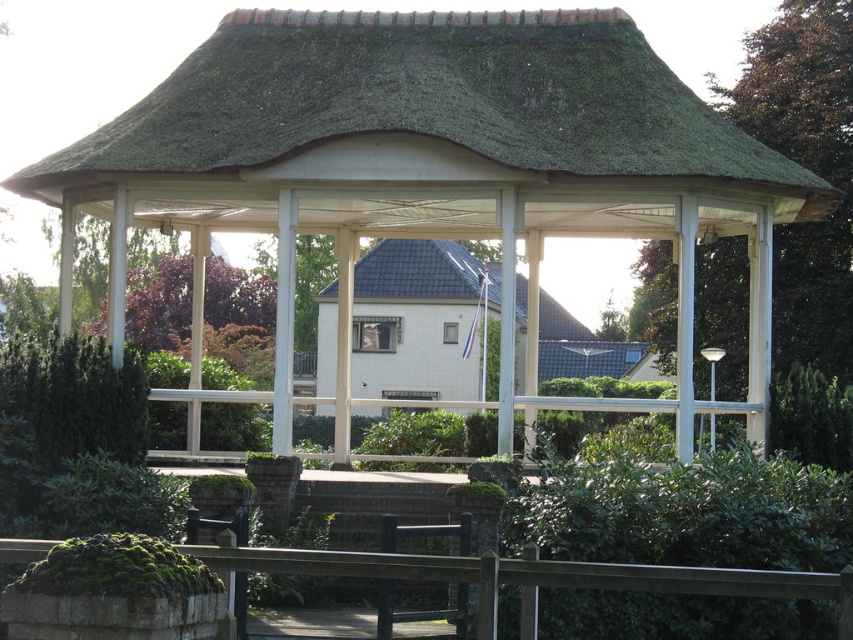
You are standing in the garden and want to place a new decorative flagpole between the white wooden gazebo at center and the dark gray shingles at center. Based on their positions, which object should the flagpole be closer to?

The white wooden gazebo at center is positioned on the right side of dark gray shingles at center, so the flagpole should be placed closer to the dark gray shingles at center since it is on the left side of the gazebo.

You are standing in the garden and looking at the gazebo. Which object is nearer to you between the green thatch roof at center and the dark gray shingles at center?

The green thatch roof at center is closer to the viewer than the dark gray shingles at center.

You are an architect evaluating the structural integrity of the gazebo. Given the green thatch roof at center and dark gray shingles at center, which part of the roof might be more prone to water damage and why?

The green thatch roof at center has a lesser width compared to dark gray shingles at center, so it might be more prone to water damage because its narrower width could lead to poor drainage and pooling water.